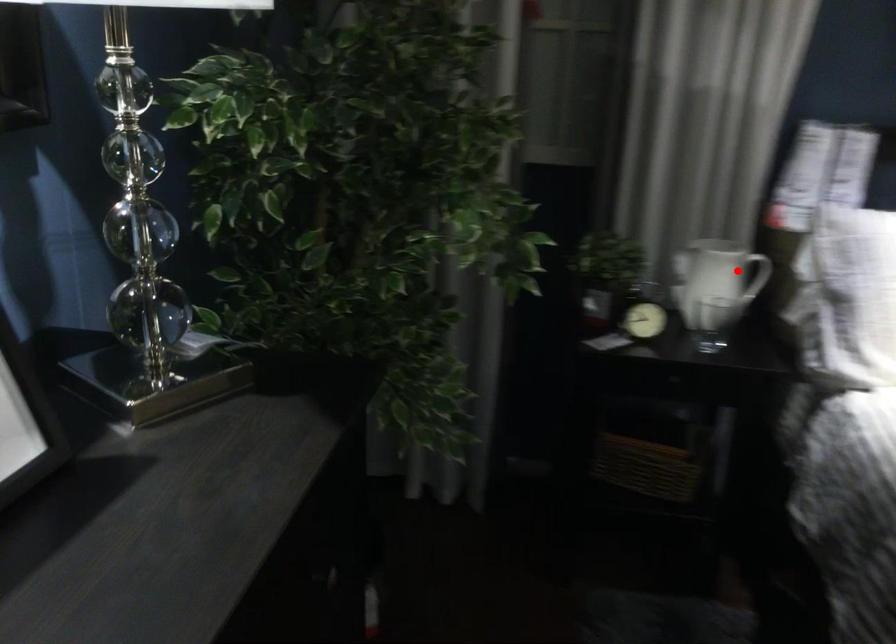
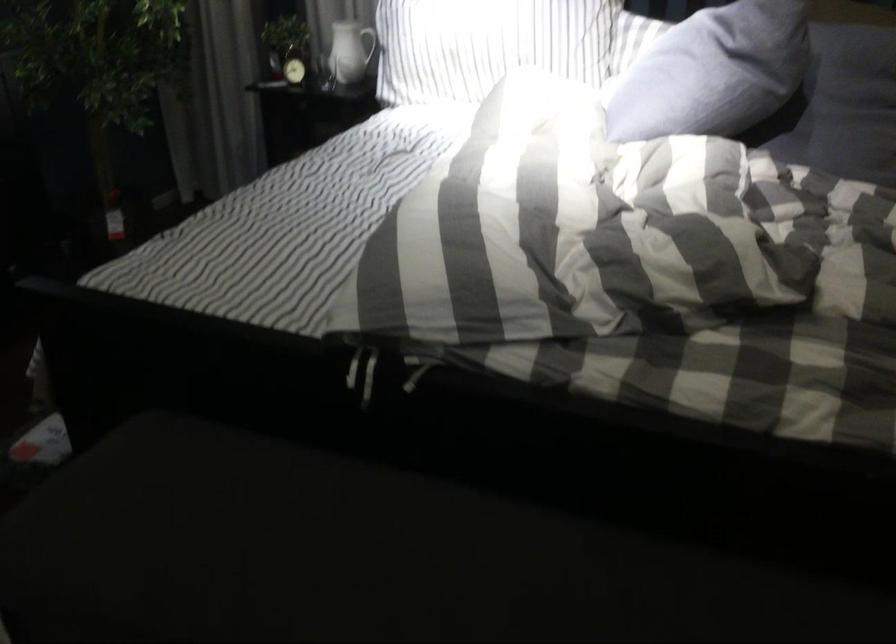
Question: I am providing you with two images of the same scene from different viewpoints. Image1 has a red point marked. In image2, the corresponding 3D location appears at what relative position? Reply with the corresponding letter.

Choices:
 (A) Closer
 (B) Farther

Answer: (B)